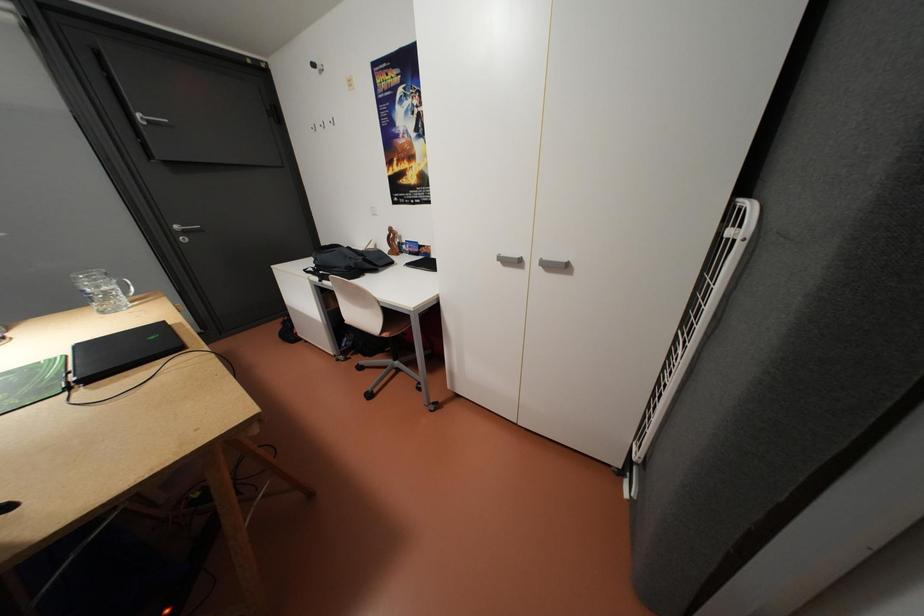
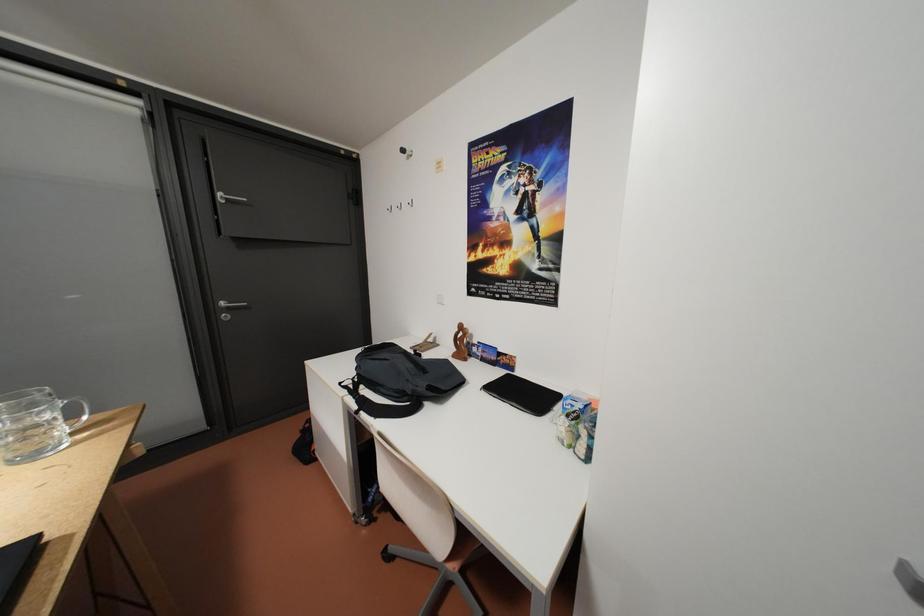
Question: The first image is from the beginning of the video and the second image is from the end. How did the camera likely rotate when shooting the video?

Choices:
 (A) Left
 (B) Right
 (C) Up
 (D) Down

Answer: (C)